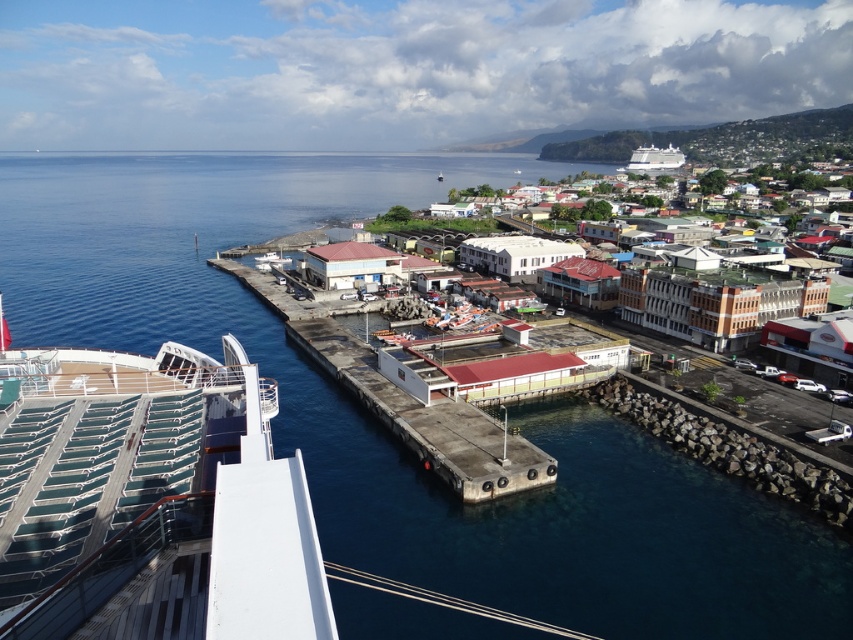
Can you confirm if teal plastic deck at lower left is smaller than white glossy cruise ship at upper right?

Yes.

Does teal plastic deck at lower left have a greater height compared to white glossy cruise ship at upper right?

No, teal plastic deck at lower left is not taller than white glossy cruise ship at upper right.

Is point (138, 477) positioned in front of point (646, 161)?

That is True.

Where is `teal plastic deck at lower left`? The width and height of the screenshot is (853, 640). teal plastic deck at lower left is located at coordinates (151, 500).

The width and height of the screenshot is (853, 640). What are the coordinates of `teal plastic deck at lower left` in the screenshot? It's located at (151, 500).

Between teal plastic deck at lower left and white matte boat at center, which one is positioned higher?

Positioned higher is white matte boat at center.

Is point (61, 419) farther from camera compared to point (277, 257)?

No, (61, 419) is closer to viewer.

Identify the location of teal plastic deck at lower left. This screenshot has width=853, height=640. (151, 500).

Who is taller, white concrete dock at center or white glossy cruise ship at upper right?

With more height is white glossy cruise ship at upper right.

Is white concrete dock at center positioned at the back of white glossy cruise ship at upper right?

No, white concrete dock at center is closer to the viewer.

This screenshot has width=853, height=640. I want to click on white concrete dock at center, so click(x=407, y=404).

The image size is (853, 640). In order to click on white concrete dock at center in this screenshot , I will do `click(407, 404)`.